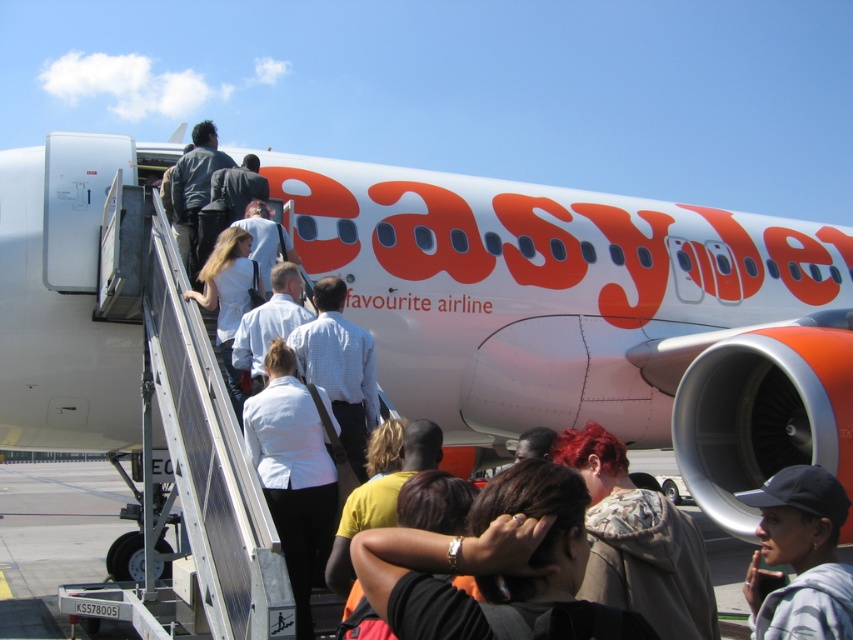
Between white matte shirt at center and gray fabric cap at lower right, which one is positioned higher?

white matte shirt at center is above.

You are a GUI agent. You are given a task and a screenshot of the screen. Output one action in this format:
    pyautogui.click(x=<x>, y=<y>)
    Task: Click on the white matte shirt at center
    This screenshot has height=640, width=853.
    Given the screenshot: What is the action you would take?
    pyautogui.click(x=293, y=474)

The image size is (853, 640). What do you see at coordinates (496, 564) in the screenshot?
I see `dark brown hair at center` at bounding box center [496, 564].

Can you confirm if dark brown hair at center is taller than gray fabric cap at lower right?

Incorrect, dark brown hair at center's height is not larger of gray fabric cap at lower right's.

Which is in front, point (508, 525) or point (802, 625)?

Point (508, 525)

The width and height of the screenshot is (853, 640). Identify the location of dark brown hair at center. (496, 564).

Which of these two, fluffy hoodie at center or white matte shirt at center, stands taller?

white matte shirt at center

Looking at this image, who is more forward, (660, 580) or (300, 467)?

Point (660, 580) is more forward.

Find the location of `fluffy hoodie at center`. fluffy hoodie at center is located at coordinates (637, 541).